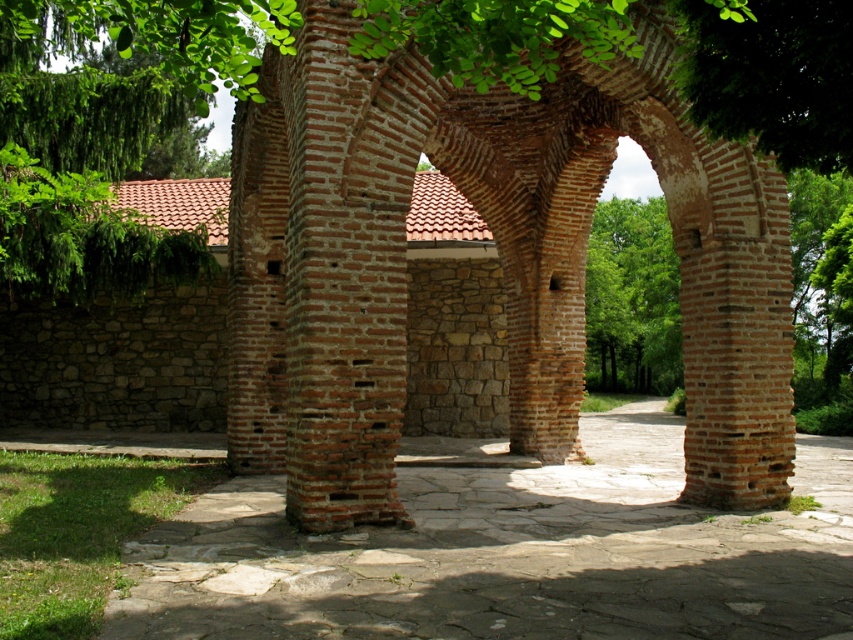
Looking at this image, can you confirm if brown brick arch at center is wider than brown stone courtyard at center?

No, brown brick arch at center is not wider than brown stone courtyard at center.

Between point (577, 252) and point (845, 502), which one is positioned in front?

Point (845, 502) is more forward.

Which is behind, point (782, 317) or point (486, 550)?

The point (782, 317) is more distant.

Where is `brown brick arch at center`? brown brick arch at center is located at coordinates (498, 259).